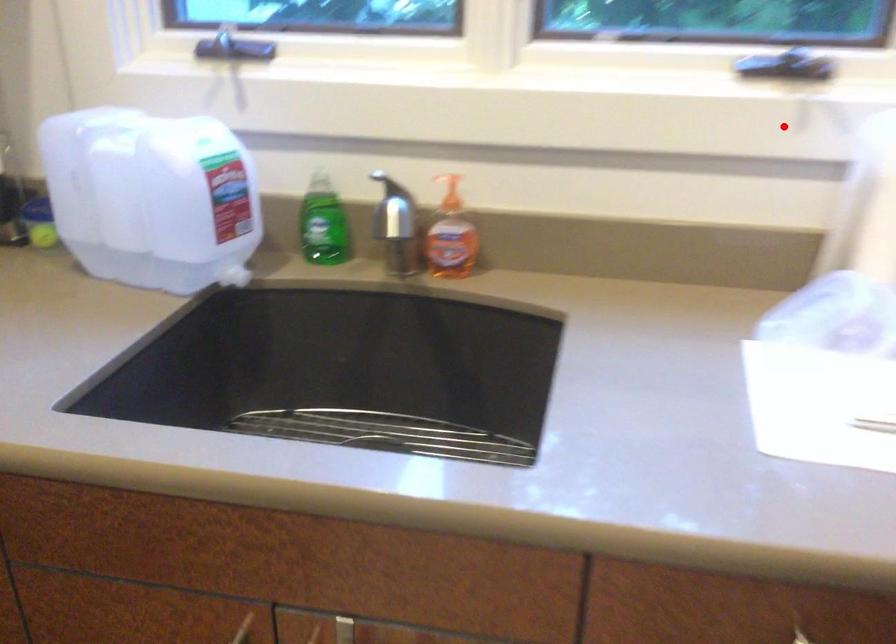
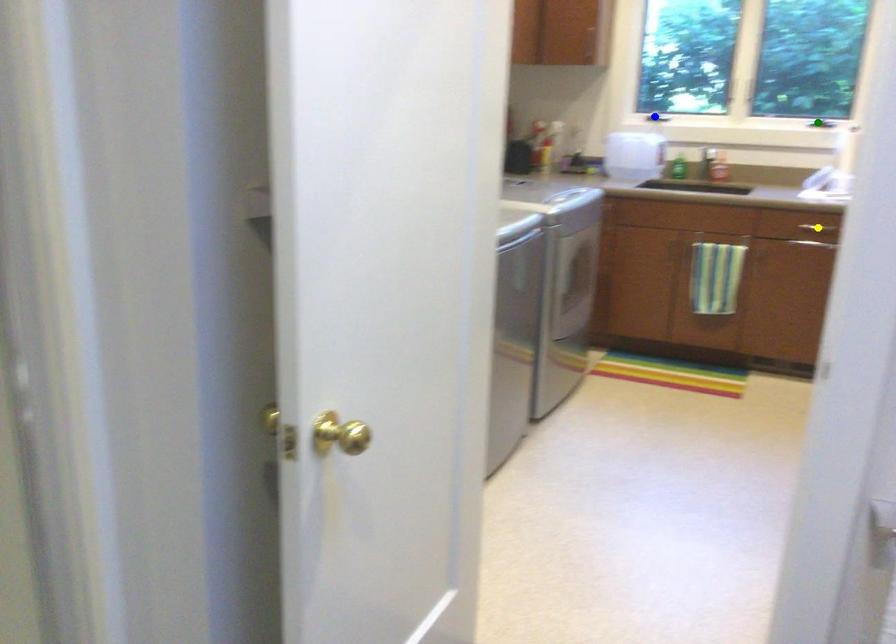
Question: I am providing you with two images of the same scene from different viewpoints. A red point is marked on the first image. You are given multiple points on the second image. Which point in image 2 represents the same 3d spot as the red point in image 1?

Choices:
 (A) green point
 (B) blue point
 (C) yellow point

Answer: (A)